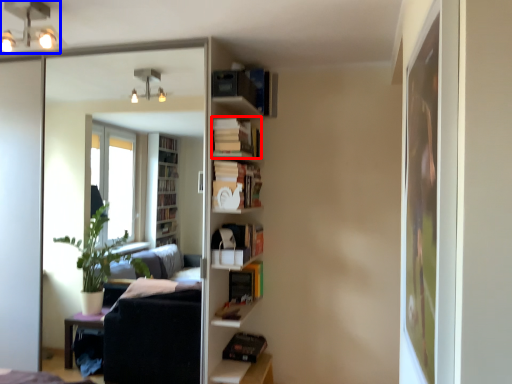
Question: Which object appears closest to the camera in this image, book (highlighted by a red box) or light fixture (highlighted by a blue box)?

Choices:
 (A) book
 (B) light fixture

Answer: (B)